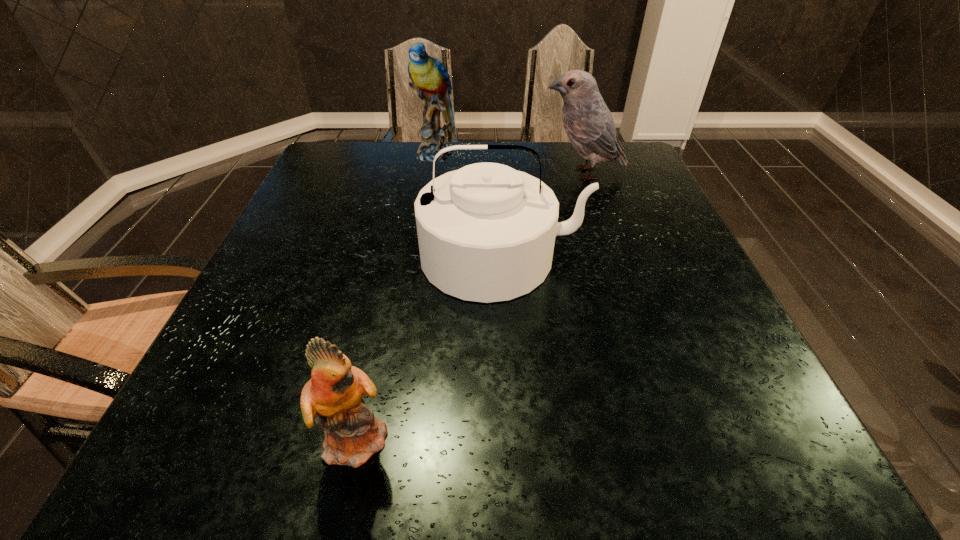
Locate which object ranks third in proximity to the rightmost parrot. Please provide its 2D coordinates. Your answer should be formatted as a tuple, i.e. [(x, y)], where the tuple contains the x and y coordinates of a point satisfying the conditions above.

[(334, 393)]

Identify which object is located as the second nearest to the rightmost parrot. Please provide its 2D coordinates. Your answer should be formatted as a tuple, i.e. [(x, y)], where the tuple contains the x and y coordinates of a point satisfying the conditions above.

[(430, 79)]

Select which parrot is the second closest to the rightmost parrot. Please provide its 2D coordinates. Your answer should be formatted as a tuple, i.e. [(x, y)], where the tuple contains the x and y coordinates of a point satisfying the conditions above.

[(334, 393)]

This screenshot has height=540, width=960. Find the location of `parrot that is the second closest to the rightmost parrot`. parrot that is the second closest to the rightmost parrot is located at coordinates tap(334, 393).

At what (x,y) coordinates should I click in order to perform the action: click on vacant space that satisfies the following two spatial constraints: 1. on the spout of the second nearest object; 2. on the front-facing side of the nearest object. Please return your answer as a coordinate pair (x, y). This screenshot has height=540, width=960. Looking at the image, I should click on (513, 437).